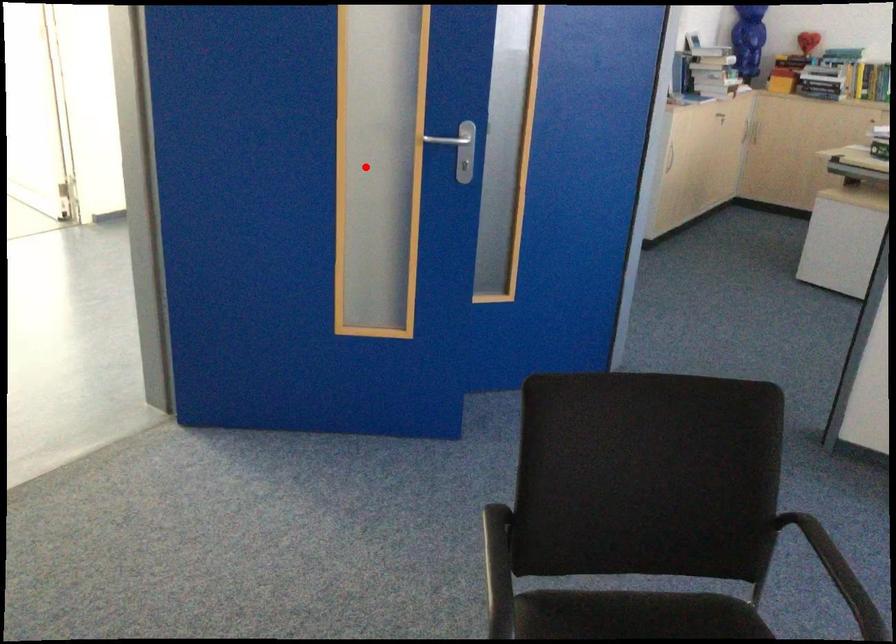
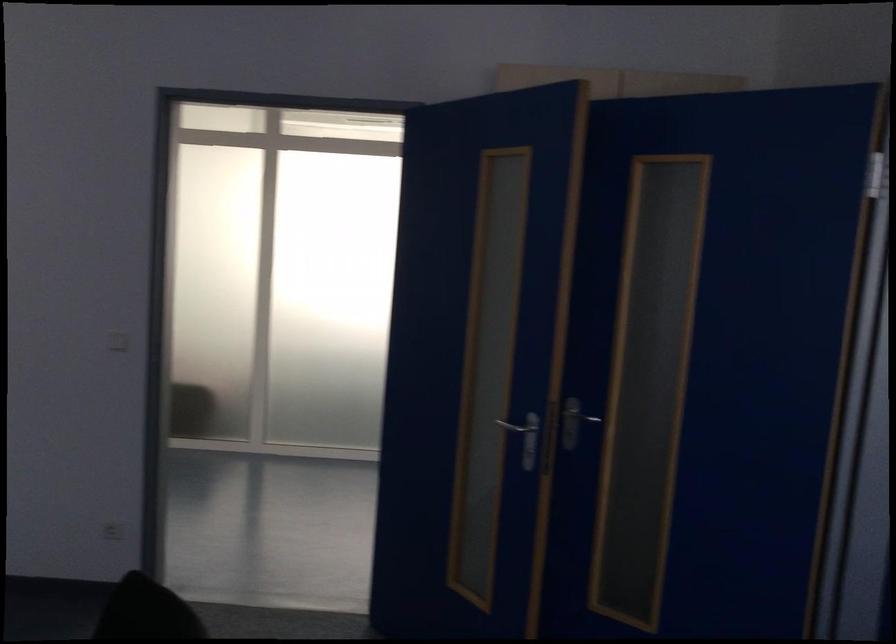
Locate, in the second image, the point that corresponds to the highlighted location in the first image.

(528, 438)